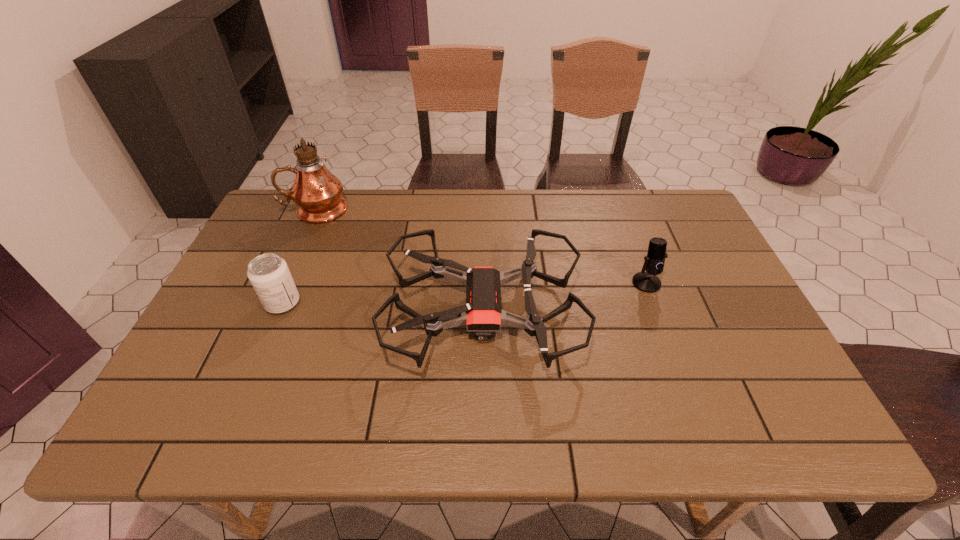
At what (x,y) coordinates should I click in order to perform the action: click on vacant space that is in between the microphone and the soda can. Please return your answer as a coordinate pair (x, y). Looking at the image, I should click on (465, 293).

Locate an element on the screen. free spot between the soda can and the rightmost object is located at coordinates (465, 293).

You are a GUI agent. You are given a task and a screenshot of the screen. Output one action in this format:
    pyautogui.click(x=<x>, y=<y>)
    Task: Click on the vacant space that is in between the farthest object and the soda can
    This screenshot has width=960, height=540.
    Given the screenshot: What is the action you would take?
    pyautogui.click(x=300, y=256)

At what (x,y) coordinates should I click in order to perform the action: click on free space between the farthest object and the rightmost object. Please return your answer as a coordinate pair (x, y). The height and width of the screenshot is (540, 960). Looking at the image, I should click on (481, 246).

Image resolution: width=960 pixels, height=540 pixels. I want to click on vacant area that lies between the microphone and the shortest object, so click(564, 298).

At what (x,y) coordinates should I click in order to perform the action: click on vacant area that lies between the third object from left to right and the rightmost object. Please return your answer as a coordinate pair (x, y). Looking at the image, I should click on (564, 298).

In order to click on vacant area between the shortest object and the rightmost object in this screenshot , I will do `click(564, 298)`.

I want to click on free space between the tallest object and the soda can, so click(x=300, y=256).

Find the location of a particular element. object that can be found as the third closest to the shortest object is located at coordinates (317, 192).

Find the location of a particular element. object that is the second closest one to the soda can is located at coordinates (317, 192).